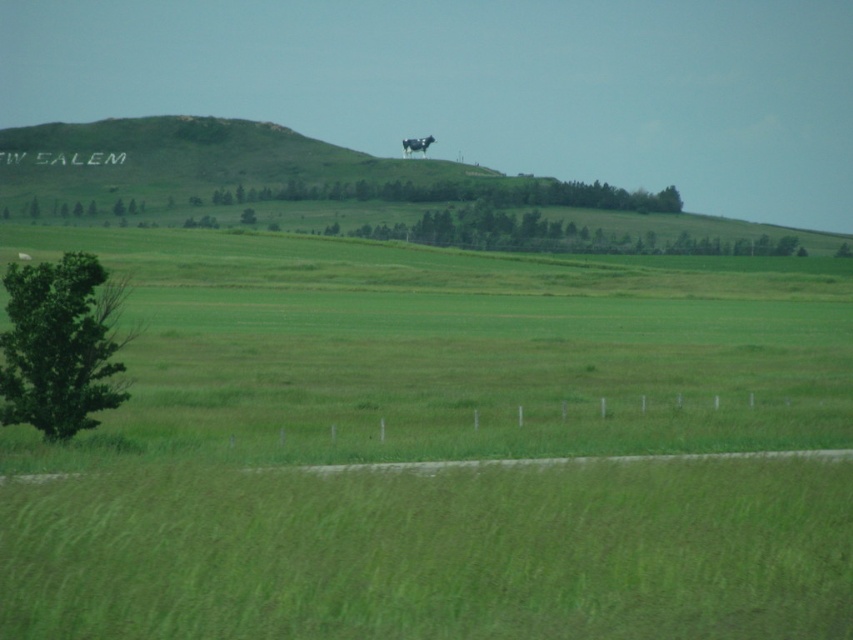
Question: Is green grassy hillside at upper center to the right of green leafy tree at lower left from the viewer's perspective?

Choices:
 (A) yes
 (B) no

Answer: (B)

Question: Among these points, which one is farthest from the camera?

Choices:
 (A) (361, 164)
 (B) (115, 396)

Answer: (A)

Question: Which point is closer to the camera taking this photo?

Choices:
 (A) (21, 285)
 (B) (173, 177)

Answer: (A)

Question: In this image, where is green grassy hillside at upper center located relative to green leafy tree at lower left?

Choices:
 (A) below
 (B) above

Answer: (B)

Question: Which point is closer to the camera?

Choices:
 (A) (59, 314)
 (B) (131, 186)

Answer: (A)

Question: Is green grassy hillside at upper center below green leafy tree at lower left?

Choices:
 (A) yes
 (B) no

Answer: (B)